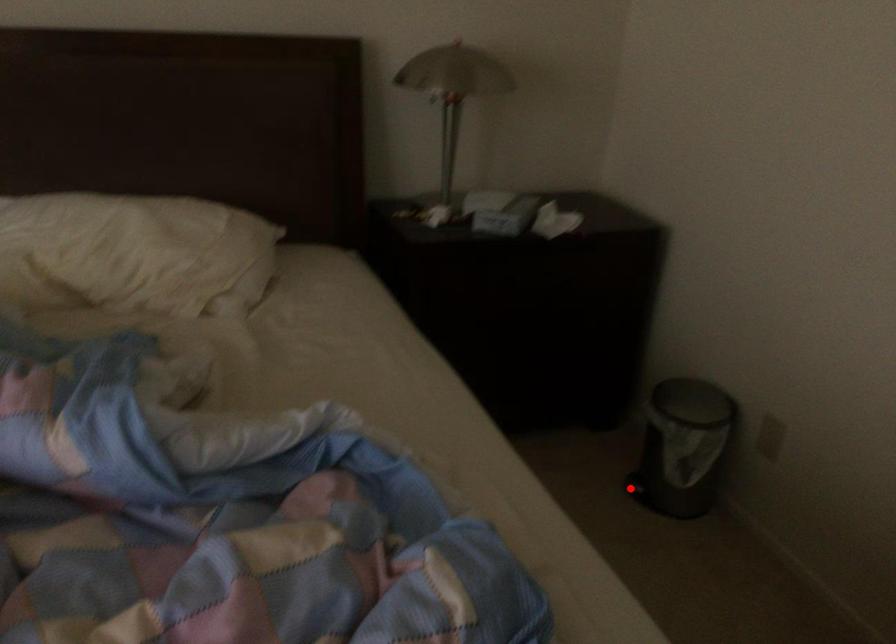
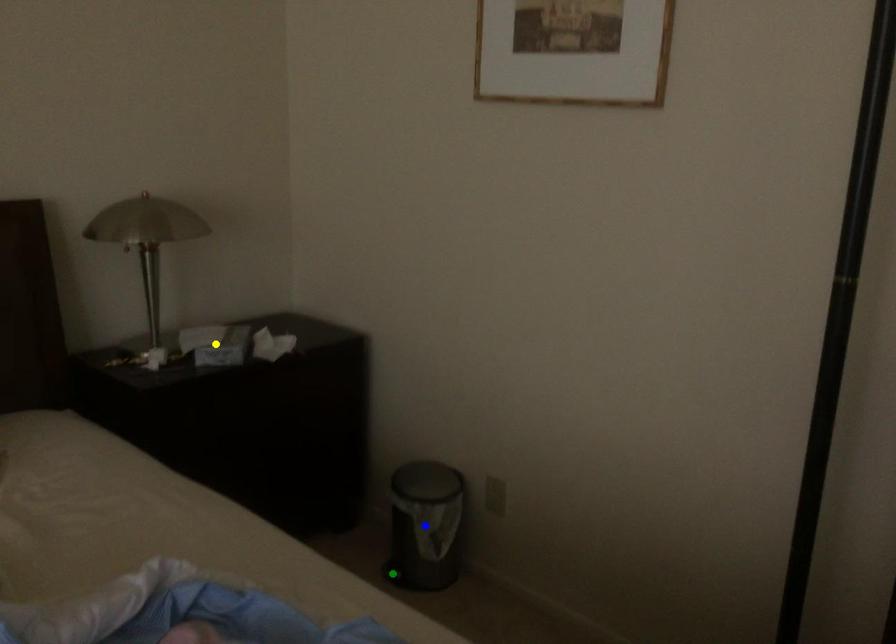
Question: I am providing you with two images of the same scene from different viewpoints. A red point is marked on the first image. You are given multiple points on the second image. Which point in image 2 is actually the same real-world point as the red point in image 1?

Choices:
 (A) yellow point
 (B) green point
 (C) blue point

Answer: (B)